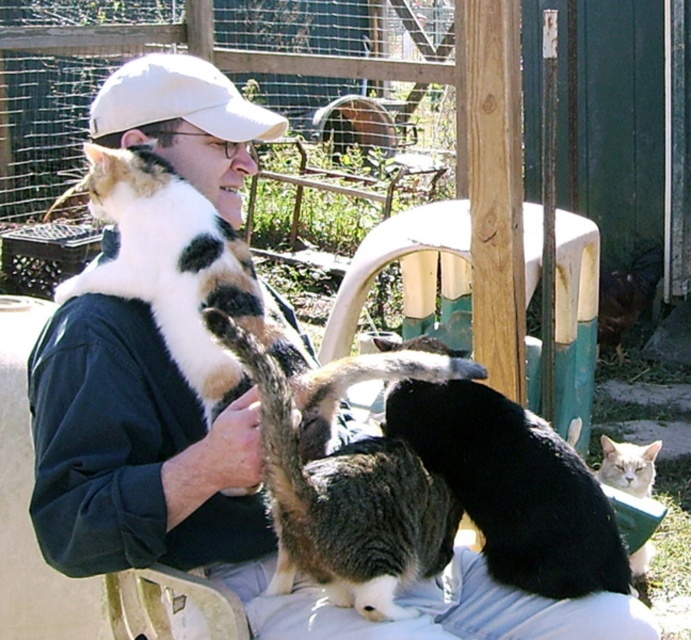
Based on the scene description, can you determine the relative positions of the gray tabby cat at center and the white fabric cap at upper center?

The gray tabby cat at center is positioned to the right of the white fabric cap at upper center.

You are a photographer trying to capture the gray tabby cat at center in your shot. Based on the coordinates provided, where should you aim your camera?

The gray tabby cat at center is located at point (343, 500), so aim your camera at those coordinates to capture it.